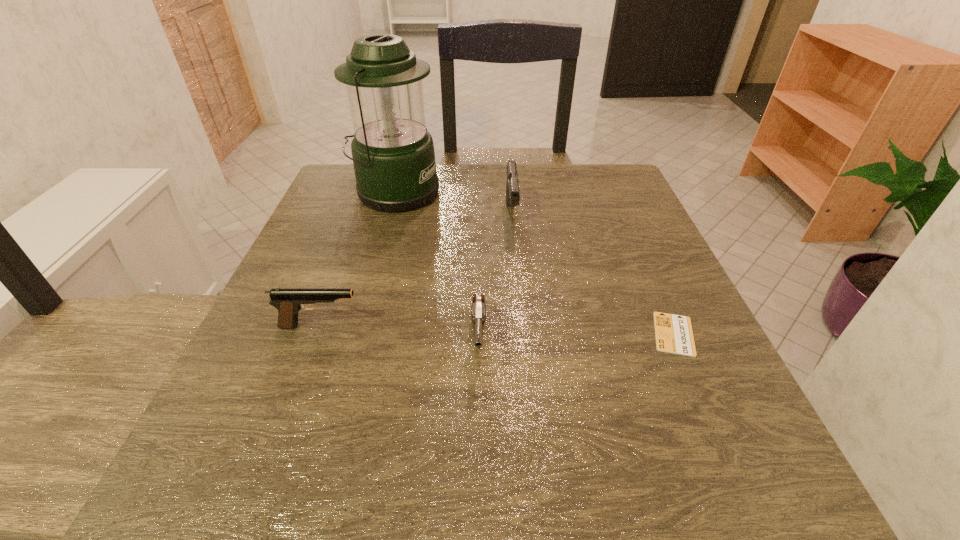
At what (x,y) coordinates should I click in order to perform the action: click on blank area located at the muzzle of the leftmost pistol. Please return your answer as a coordinate pair (x, y). Looking at the image, I should click on (420, 326).

Where is `free location located on the left of the shortest object`? free location located on the left of the shortest object is located at coordinates [502, 334].

Where is `lantern that is at the far edge`? Image resolution: width=960 pixels, height=540 pixels. lantern that is at the far edge is located at coordinates (393, 155).

Where is `pistol situated at the far edge`? The width and height of the screenshot is (960, 540). pistol situated at the far edge is located at coordinates (512, 188).

What are the coordinates of `lantern that is at the left edge` in the screenshot? It's located at (393, 155).

What are the coordinates of `pistol that is positioned at the left edge` in the screenshot? It's located at (289, 301).

Where is `object at the right edge`? The width and height of the screenshot is (960, 540). object at the right edge is located at coordinates (674, 334).

Where is `object that is at the far left corner`? object that is at the far left corner is located at coordinates (393, 155).

In the image, there is a desktop. What are the coordinates of `vacant space at the far edge` in the screenshot? It's located at (438, 201).

Image resolution: width=960 pixels, height=540 pixels. In the image, there is a desktop. Find the location of `vacant space at the near edge`. vacant space at the near edge is located at coordinates (456, 484).